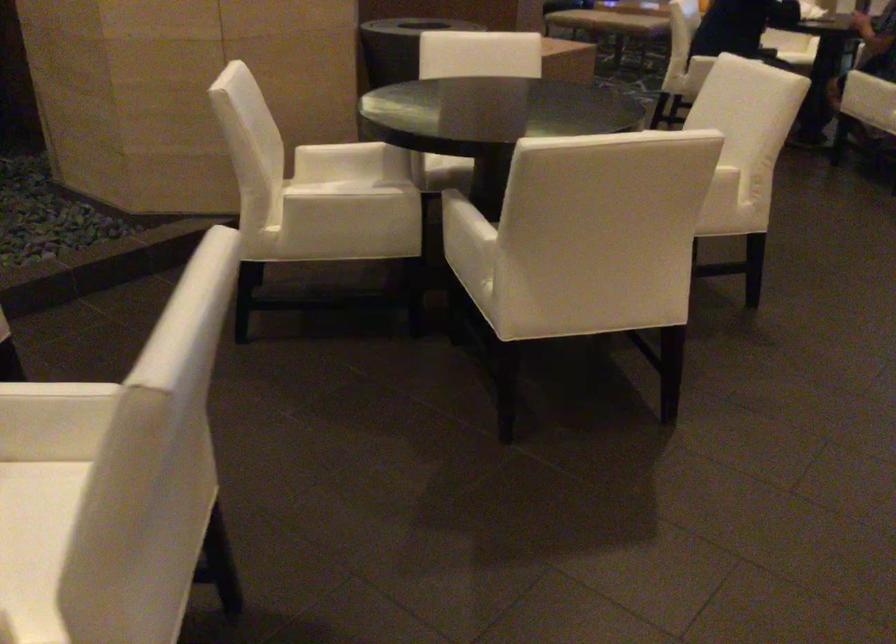
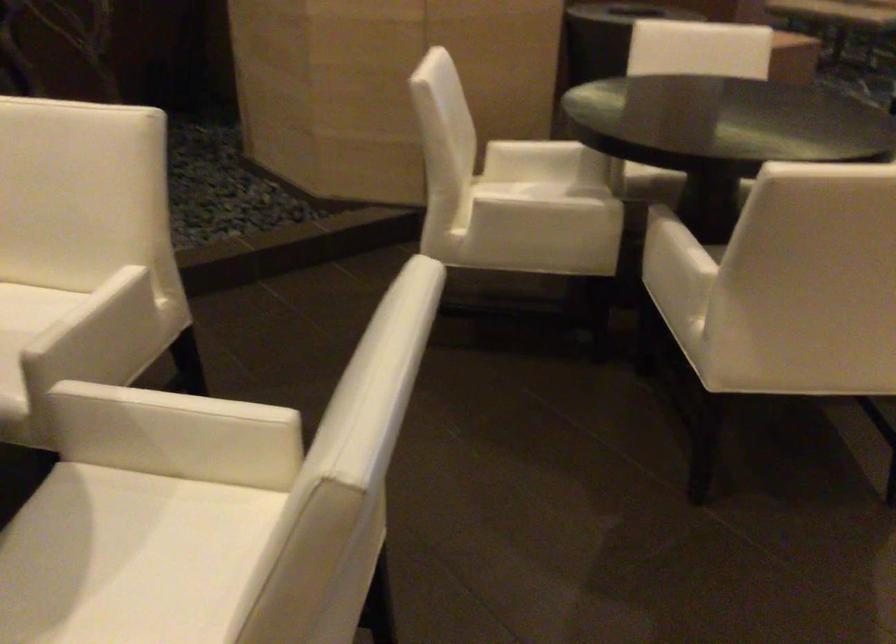
Find the pixel in the second image that matches pixel 342 153 in the first image.

(543, 152)